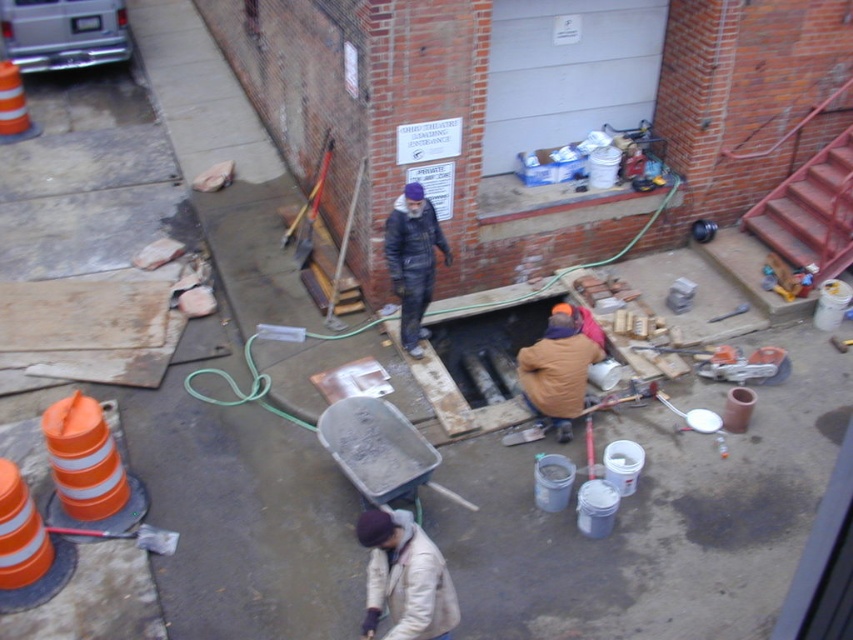
Question: Among these points, which one is farthest from the camera?

Choices:
 (A) (549, 339)
 (B) (421, 284)
 (C) (9, 113)
 (D) (440, 589)

Answer: (C)

Question: Is white matte jacket at lower center to the left of dark blue denim overalls at center from the viewer's perspective?

Choices:
 (A) yes
 (B) no

Answer: (A)

Question: Which point appears closest to the camera in this image?

Choices:
 (A) tap(405, 224)
 (B) tap(369, 540)

Answer: (B)

Question: Considering the real-world distances, which object is farthest from the orange reflective traffic cone at left?

Choices:
 (A) white matte jacket at lower center
 (B) dark blue denim overalls at center
 (C) orange fuzzy hat at lower center

Answer: (A)

Question: Is orange fuzzy hat at lower center above orange reflective traffic cone at left?

Choices:
 (A) yes
 (B) no

Answer: (B)

Question: Does orange fuzzy hat at lower center have a smaller size compared to orange reflective traffic cone at left?

Choices:
 (A) yes
 (B) no

Answer: (B)